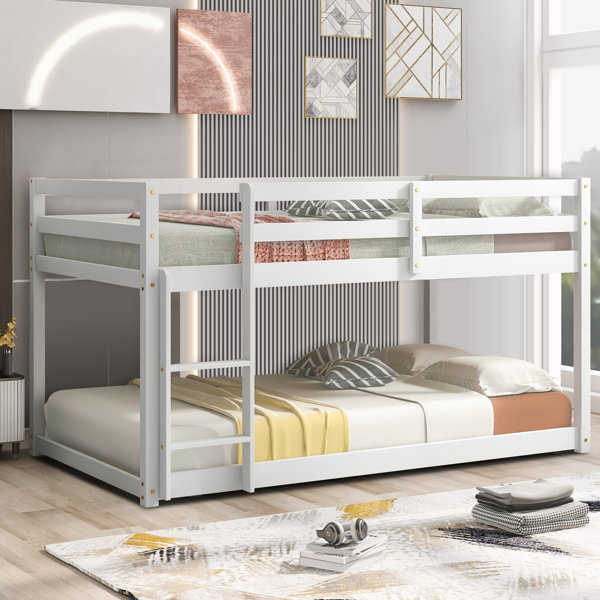
Locate an element on the screen. The width and height of the screenshot is (600, 600). gray and brown rug is located at coordinates (413, 570).